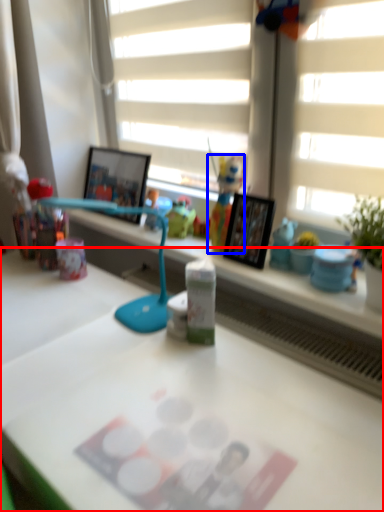
Question: Among these objects, which one is nearest to the camera, desk (highlighted by a red box) or toy (highlighted by a blue box)?

Choices:
 (A) desk
 (B) toy

Answer: (A)